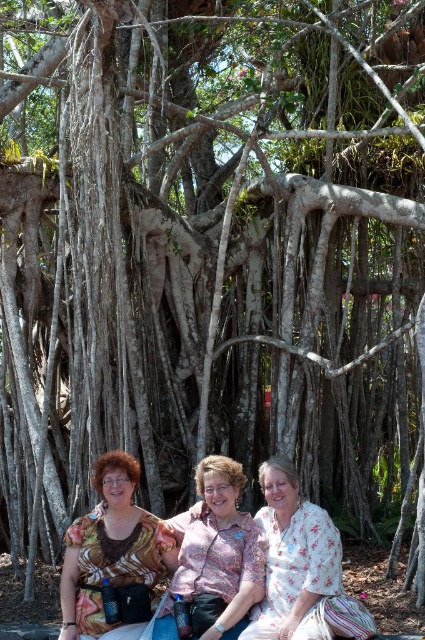
Measure the distance between point (x=158, y=632) and camera.

15.85 meters

The image size is (425, 640). What are the coordinates of `pink floral blouse at center` in the screenshot? It's located at (215, 556).

Who is positioned more to the left, printed fabric blouse at lower left or pink floral blouse at center?

printed fabric blouse at lower left

Is point (144, 595) more distant than point (226, 540)?

No, it is in front of (226, 540).

The image size is (425, 640). Find the location of `printed fabric blouse at lower left`. printed fabric blouse at lower left is located at coordinates (113, 557).

Which is below, printed fabric blouse at lower left or floral fabric blouse at center?

floral fabric blouse at center is lower down.

Which is more to the right, printed fabric blouse at lower left or floral fabric blouse at center?

From the viewer's perspective, floral fabric blouse at center appears more on the right side.

Where is `printed fabric blouse at lower left`? Image resolution: width=425 pixels, height=640 pixels. printed fabric blouse at lower left is located at coordinates (113, 557).